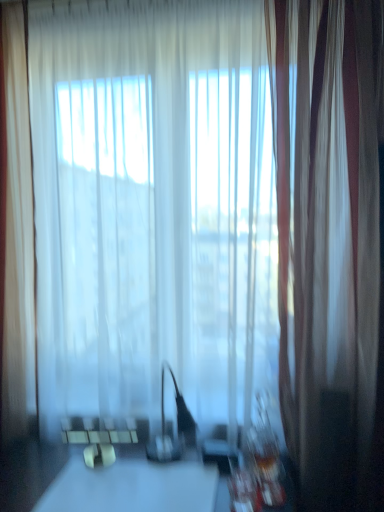
Question: From the image's perspective, is transparent fabric at center located above white glossy table at center?

Choices:
 (A) no
 (B) yes

Answer: (B)

Question: From a real-world perspective, is transparent fabric at center located higher than white glossy table at center?

Choices:
 (A) yes
 (B) no

Answer: (A)

Question: Is transparent fabric at center facing towards white glossy table at center?

Choices:
 (A) yes
 (B) no

Answer: (A)

Question: Is transparent fabric at center smaller than white glossy table at center?

Choices:
 (A) yes
 (B) no

Answer: (B)

Question: Considering the relative sizes of transparent fabric at center and white glossy table at center in the image provided, is transparent fabric at center taller than white glossy table at center?

Choices:
 (A) no
 (B) yes

Answer: (B)

Question: Is transparent fabric at center thinner than white glossy table at center?

Choices:
 (A) yes
 (B) no

Answer: (A)

Question: From the image's perspective, is white glossy table at center over translucent white curtain at left, arranged as the second curtain when viewed from the right?

Choices:
 (A) yes
 (B) no

Answer: (B)

Question: Can you confirm if white glossy table at center is shorter than translucent white curtain at left, arranged as the second curtain when viewed from the right?

Choices:
 (A) yes
 (B) no

Answer: (A)

Question: Is white glossy table at center located outside translucent white curtain at left, arranged as the second curtain when viewed from the right?

Choices:
 (A) no
 (B) yes

Answer: (B)

Question: Does white glossy table at center have a lesser width compared to translucent white curtain at left, the first curtain positioned from the left?

Choices:
 (A) no
 (B) yes

Answer: (A)

Question: Is white glossy table at center at the right side of translucent white curtain at left, the first curtain positioned from the left?

Choices:
 (A) no
 (B) yes

Answer: (B)

Question: Does white glossy table at center come behind translucent white curtain at left, arranged as the second curtain when viewed from the right?

Choices:
 (A) no
 (B) yes

Answer: (A)

Question: Does translucent white curtain at left, the first curtain positioned from the left, have a lesser width compared to silky white curtain at right, the first curtain in the right-to-left sequence?

Choices:
 (A) no
 (B) yes

Answer: (B)